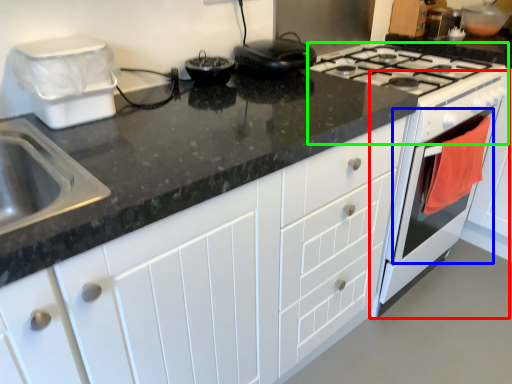
Question: Considering the real-world distances, which object is farthest from oven (highlighted by a red box)? oven (highlighted by a blue box) or gas stove (highlighted by a green box)?

Choices:
 (A) oven
 (B) gas stove

Answer: (B)